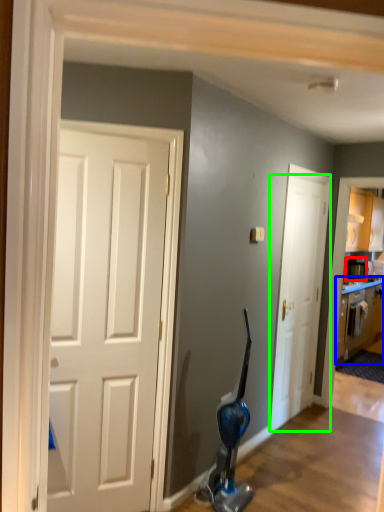
Question: Considering the real-world distances, which object is closest to appliance (highlighted by a red box)? cabinetry (highlighted by a blue box) or door (highlighted by a green box).

Choices:
 (A) cabinetry
 (B) door

Answer: (A)